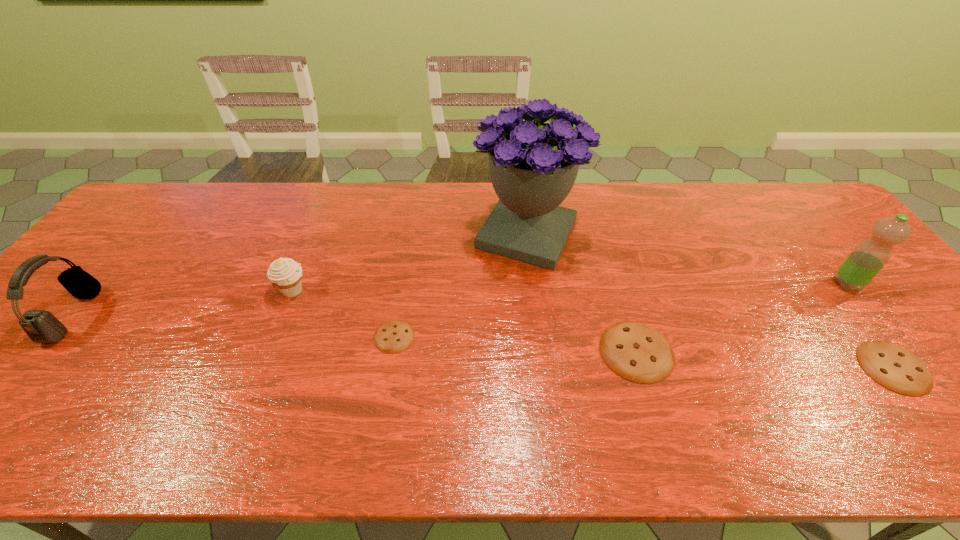
The width and height of the screenshot is (960, 540). I want to click on the leftmost object, so click(x=41, y=326).

Find the location of a particular element. This screenshot has width=960, height=540. headset is located at coordinates (41, 326).

This screenshot has height=540, width=960. In order to click on free spot located on the left of the shortest object in this screenshot , I will do `click(333, 336)`.

This screenshot has width=960, height=540. Identify the location of free space located 0.340m on the left of the second cookie from right to left. (457, 352).

You are a GUI agent. You are given a task and a screenshot of the screen. Output one action in this format:
    pyautogui.click(x=<x>, y=<y>)
    Task: Click on the free space located 0.310m on the left of the rightmost cookie
    The width and height of the screenshot is (960, 540).
    Given the screenshot: What is the action you would take?
    pyautogui.click(x=727, y=367)

The width and height of the screenshot is (960, 540). What are the coordinates of `vacant space situated 0.050m on the left of the water bottle` in the screenshot? It's located at (814, 285).

Locate an element on the screen. vacant space located 0.250m on the right of the farthest object is located at coordinates (662, 234).

I want to click on free region located 0.240m on the back of the muffin, so click(320, 224).

Locate an element on the screen. The height and width of the screenshot is (540, 960). vacant space located 0.390m on the headband of the third tallest object is located at coordinates (237, 315).

Identify the location of object located in the far edge section of the desktop. This screenshot has height=540, width=960. [533, 165].